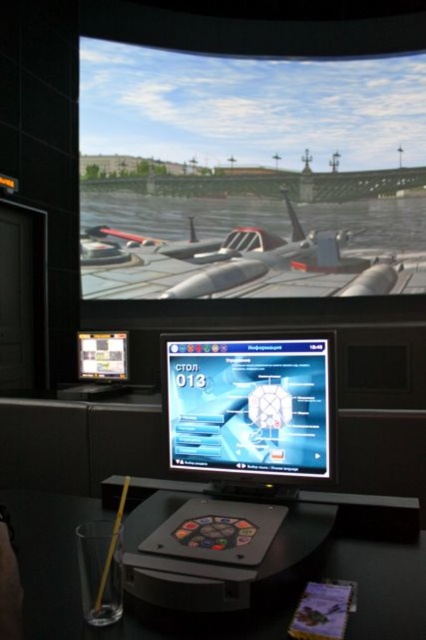
Is shiny silver monitor at center above matte plastic screen at upper left?

Yes, shiny silver monitor at center is above matte plastic screen at upper left.

Does point (252, 444) come in front of point (86, 342)?

Yes, it is in front of point (86, 342).

Describe the element at coordinates (249, 404) in the screenshot. I see `shiny silver monitor at center` at that location.

This screenshot has height=640, width=426. Find the location of `shiny silver monitor at center`. shiny silver monitor at center is located at coordinates (249, 404).

Does point (85, 246) come in front of point (51, 547)?

No, it is not.

Does shiny silver aircraft at center have a lesser height compared to black plastic table at lower center?

Incorrect, shiny silver aircraft at center's height does not fall short of black plastic table at lower center's.

Is point (302, 244) closer to camera compared to point (334, 572)?

No, it is behind (334, 572).

Where is `shiny silver aircraft at center`? Image resolution: width=426 pixels, height=640 pixels. shiny silver aircraft at center is located at coordinates coord(250,246).

Which is more to the left, black plastic table at lower center or matte plastic screen at upper left?

Positioned to the left is matte plastic screen at upper left.

Looking at this image, does black plastic table at lower center have a lesser width compared to matte plastic screen at upper left?

No.

Who is more distant from viewer, [17,499] or [115,353]?

The point [115,353] is behind.

You are a GUI agent. You are given a task and a screenshot of the screen. Output one action in this format:
    pyautogui.click(x=<x>, y=<y>)
    Task: Click on the black plastic table at lower center
    This screenshot has height=640, width=426.
    Given the screenshot: What is the action you would take?
    pyautogui.click(x=78, y=580)